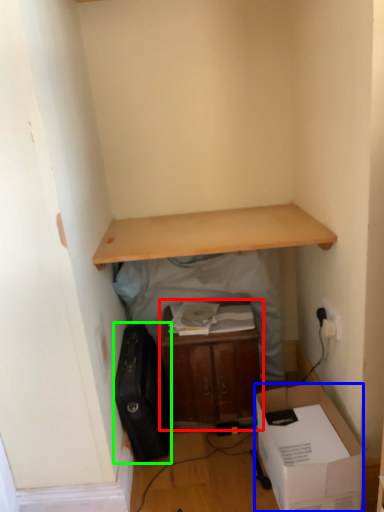
Question: Based on their relative distances, which object is farther from table (highlighted by a red box)? Choose from box (highlighted by a blue box) and luggage (highlighted by a green box).

Choices:
 (A) box
 (B) luggage

Answer: (A)